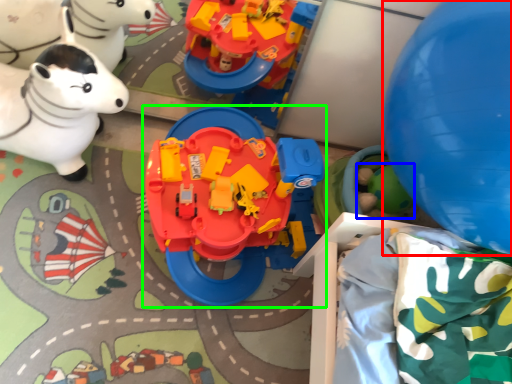
Question: Based on their relative distances, which object is farther from balloon (highlighted by a red box)? Choose from toy (highlighted by a blue box) and toy (highlighted by a green box).

Choices:
 (A) toy
 (B) toy

Answer: (A)